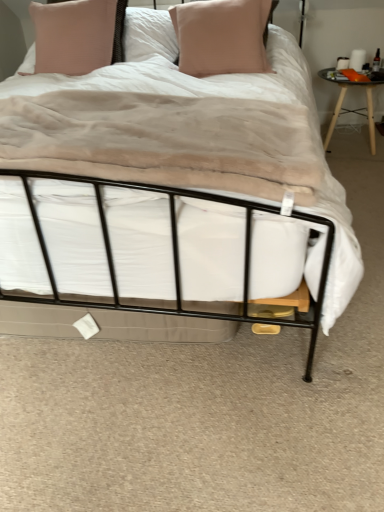
Image resolution: width=384 pixels, height=512 pixels. Describe the element at coordinates (78, 35) in the screenshot. I see `matte pink pillow at upper center, which ranks as the 2th pillow in right-to-left order` at that location.

You are a GUI agent. You are given a task and a screenshot of the screen. Output one action in this format:
    pyautogui.click(x=<x>, y=<y>)
    Task: Click on the black glass table at right
    This screenshot has height=512, width=384.
    Given the screenshot: What is the action you would take?
    pyautogui.click(x=348, y=109)

Based on the photo, from the image's perspective, which object appears higher, matte pink pillow at upper center, positioned as the 1th pillow in left-to-right order, or black metal bed at center?

matte pink pillow at upper center, positioned as the 1th pillow in left-to-right order, from the image's perspective.

Which of these two, matte pink pillow at upper center, positioned as the 1th pillow in left-to-right order, or black metal bed at center, is bigger?

With larger size is black metal bed at center.

Does point (207, 224) lie behind point (178, 19)?

That is False.

Could you tell me if black metal bed at center is facing pink fabric pillow at center, placed as the first pillow when sorted from right to left?

No, black metal bed at center does not turn towards pink fabric pillow at center, placed as the first pillow when sorted from right to left.

Relative to pink fabric pillow at center, placed as the first pillow when sorted from right to left, is black metal bed at center in front or behind?

Clearly, black metal bed at center is in front of pink fabric pillow at center, placed as the first pillow when sorted from right to left.

Is there a large distance between black metal bed at center and pink fabric pillow at center, placed as the 2th pillow when sorted from left to right?

No.

Is black glass table at right in front of pink fabric pillow at center, placed as the first pillow when sorted from right to left?

No, black glass table at right is further to the viewer.

How different are the orientations of black glass table at right and pink fabric pillow at center, placed as the first pillow when sorted from right to left, in degrees?

The angle between the facing direction of black glass table at right and the facing direction of pink fabric pillow at center, placed as the first pillow when sorted from right to left, is 5.48 degrees.

Would you say black glass table at right is a long distance from pink fabric pillow at center, placed as the first pillow when sorted from right to left?

No.

Does black metal bed at center come in front of black glass table at right?

Yes, it is in front of black glass table at right.

Which is in front, point (62, 214) or point (369, 81)?

The point (62, 214) is more forward.

Considering the sizes of black metal bed at center and black glass table at right in the image, is black metal bed at center taller or shorter than black glass table at right?

Clearly, black metal bed at center is shorter compared to black glass table at right.

Is black glass table at right located within black metal bed at center?

That's incorrect, black glass table at right is not inside black metal bed at center.

Considering the relative sizes of pink fabric pillow at center, placed as the 2th pillow when sorted from left to right, and black metal bed at center in the image provided, is pink fabric pillow at center, placed as the 2th pillow when sorted from left to right, thinner than black metal bed at center?

Yes, pink fabric pillow at center, placed as the 2th pillow when sorted from left to right, is thinner than black metal bed at center.

Considering the relative sizes of pink fabric pillow at center, placed as the first pillow when sorted from right to left, and black metal bed at center in the image provided, is pink fabric pillow at center, placed as the first pillow when sorted from right to left, taller than black metal bed at center?

Yes, pink fabric pillow at center, placed as the first pillow when sorted from right to left, is taller than black metal bed at center.

From a real-world perspective, between pink fabric pillow at center, placed as the 2th pillow when sorted from left to right, and black metal bed at center, who is vertically lower?

black metal bed at center.

You are a GUI agent. You are given a task and a screenshot of the screen. Output one action in this format:
    pyautogui.click(x=<x>, y=<y>)
    Task: Click on the 1st pillow to the left when counting from the black metal bed at center
    This screenshot has width=384, height=512.
    Given the screenshot: What is the action you would take?
    pyautogui.click(x=222, y=36)

From the picture: Are pink fabric pillow at center, placed as the 2th pillow when sorted from left to right, and black glass table at right making contact?

There is a gap between pink fabric pillow at center, placed as the 2th pillow when sorted from left to right, and black glass table at right.

Based on the photo, is pink fabric pillow at center, placed as the first pillow when sorted from right to left, bigger than black glass table at right?

Yes, pink fabric pillow at center, placed as the first pillow when sorted from right to left, is bigger than black glass table at right.

How different are the orientations of pink fabric pillow at center, placed as the first pillow when sorted from right to left, and black glass table at right in degrees?

There is a 5.48-degree angle between the facing directions of pink fabric pillow at center, placed as the first pillow when sorted from right to left, and black glass table at right.

Is pink fabric pillow at center, placed as the first pillow when sorted from right to left, inside or outside of black glass table at right?

pink fabric pillow at center, placed as the first pillow when sorted from right to left, is outside black glass table at right.

Consider the image. Choose the correct answer: Is pink fabric pillow at center, placed as the 2th pillow when sorted from left to right, inside matte pink pillow at upper center, which ranks as the 2th pillow in right-to-left order, or outside it?

The correct answer is: outside.

Is pink fabric pillow at center, placed as the first pillow when sorted from right to left, looking in the opposite direction of matte pink pillow at upper center, which ranks as the 2th pillow in right-to-left order?

pink fabric pillow at center, placed as the first pillow when sorted from right to left, is not turned away from matte pink pillow at upper center, which ranks as the 2th pillow in right-to-left order.

Is the depth of pink fabric pillow at center, placed as the 2th pillow when sorted from left to right, less than that of matte pink pillow at upper center, which ranks as the 2th pillow in right-to-left order?

Yes, pink fabric pillow at center, placed as the 2th pillow when sorted from left to right, is closer to the camera.

Based on the photo, which point is more distant from viewer, [260,64] or [85,3]?

The point [85,3] is farther from the camera.

This screenshot has height=512, width=384. I want to click on the 2nd pillow positioned above the black metal bed at center (from a real-world perspective), so click(x=78, y=35).

From the black metal bed at center, count the 1st pillow to the left and point to it. Please provide its 2D coordinates.

[(222, 36)]

In the scene shown: When comparing their distances from black metal bed at center, does matte pink pillow at upper center, which ranks as the 2th pillow in right-to-left order, or black glass table at right seem closer?

The object closer to black metal bed at center is matte pink pillow at upper center, which ranks as the 2th pillow in right-to-left order.

From the image, which object appears to be nearer to black glass table at right, matte pink pillow at upper center, which ranks as the 2th pillow in right-to-left order, or black metal bed at center?

matte pink pillow at upper center, which ranks as the 2th pillow in right-to-left order, lies closer to black glass table at right than the other object.

Considering their positions, is black glass table at right positioned further to black metal bed at center than matte pink pillow at upper center, which ranks as the 2th pillow in right-to-left order?

black glass table at right is further to black metal bed at center.

Based on their spatial positions, is black metal bed at center or matte pink pillow at upper center, positioned as the 1th pillow in left-to-right order, further from pink fabric pillow at center, placed as the 2th pillow when sorted from left to right?

The object further to pink fabric pillow at center, placed as the 2th pillow when sorted from left to right, is black metal bed at center.

Looking at the image, which one is located closer to black glass table at right, pink fabric pillow at center, placed as the 2th pillow when sorted from left to right, or black metal bed at center?

pink fabric pillow at center, placed as the 2th pillow when sorted from left to right, lies closer to black glass table at right than the other object.

When comparing their distances from black metal bed at center, does matte pink pillow at upper center, positioned as the 1th pillow in left-to-right order, or pink fabric pillow at center, placed as the 2th pillow when sorted from left to right, seem further?

matte pink pillow at upper center, positioned as the 1th pillow in left-to-right order.

In the scene shown: Based on their spatial positions, is black metal bed at center or pink fabric pillow at center, placed as the 2th pillow when sorted from left to right, further from matte pink pillow at upper center, positioned as the 1th pillow in left-to-right order?

Among the two, black metal bed at center is located further to matte pink pillow at upper center, positioned as the 1th pillow in left-to-right order.

From the image, which object appears to be farther from black glass table at right, black metal bed at center or pink fabric pillow at center, placed as the 2th pillow when sorted from left to right?

The object further to black glass table at right is black metal bed at center.

Locate an element on the screen. The width and height of the screenshot is (384, 512). pillow between matte pink pillow at upper center, which ranks as the 2th pillow in right-to-left order, and black glass table at right from left to right is located at coordinates (222, 36).

Identify the location of pillow between black metal bed at center and matte pink pillow at upper center, positioned as the 1th pillow in left-to-right order, along the z-axis. (222, 36).